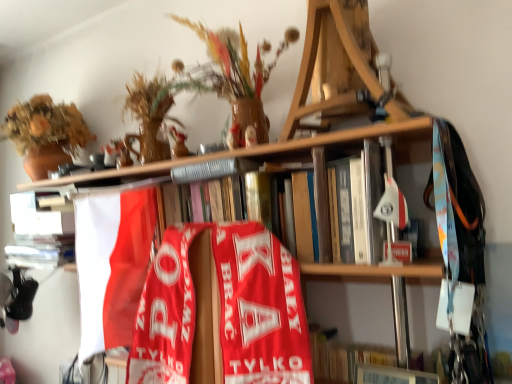
The width and height of the screenshot is (512, 384). In order to click on red fabric scarf at center in this screenshot , I will do `click(222, 311)`.

Describe the element at coordinates (222, 311) in the screenshot. I see `red fabric scarf at center` at that location.

Find the location of a particular element. red fabric scarf at center is located at coordinates (222, 311).